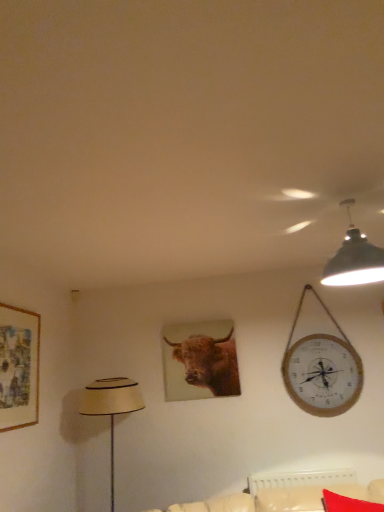
Question: From a real-world perspective, is brown matte/canvas at center under black matte lampshade at upper right?

Choices:
 (A) yes
 (B) no

Answer: (A)

Question: Is brown matte/canvas at center further to camera compared to black matte lampshade at upper right?

Choices:
 (A) yes
 (B) no

Answer: (A)

Question: Can you confirm if brown matte/canvas at center is thinner than black matte lampshade at upper right?

Choices:
 (A) yes
 (B) no

Answer: (A)

Question: Can you confirm if brown matte/canvas at center is shorter than black matte lampshade at upper right?

Choices:
 (A) yes
 (B) no

Answer: (B)

Question: Does brown matte/canvas at center have a larger size compared to black matte lampshade at upper right?

Choices:
 (A) no
 (B) yes

Answer: (A)

Question: Can you confirm if brown matte/canvas at center is wider than black matte lampshade at upper right?

Choices:
 (A) yes
 (B) no

Answer: (B)

Question: Is brown matte/canvas at center looking in the opposite direction of red fabric pillow at lower right?

Choices:
 (A) no
 (B) yes

Answer: (A)

Question: From a real-world perspective, does brown matte/canvas at center sit lower than red fabric pillow at lower right?

Choices:
 (A) no
 (B) yes

Answer: (A)

Question: Is brown matte/canvas at center wider than red fabric pillow at lower right?

Choices:
 (A) yes
 (B) no

Answer: (B)

Question: Considering the relative sizes of brown matte/canvas at center and red fabric pillow at lower right in the image provided, is brown matte/canvas at center smaller than red fabric pillow at lower right?

Choices:
 (A) yes
 (B) no

Answer: (A)

Question: Is brown matte/canvas at center far away from red fabric pillow at lower right?

Choices:
 (A) yes
 (B) no

Answer: (A)

Question: Could you tell me if brown matte/canvas at center is facing red fabric pillow at lower right?

Choices:
 (A) no
 (B) yes

Answer: (A)

Question: Is there a large distance between red fabric pillow at lower right and matte beige lampshade at left?

Choices:
 (A) yes
 (B) no

Answer: (A)